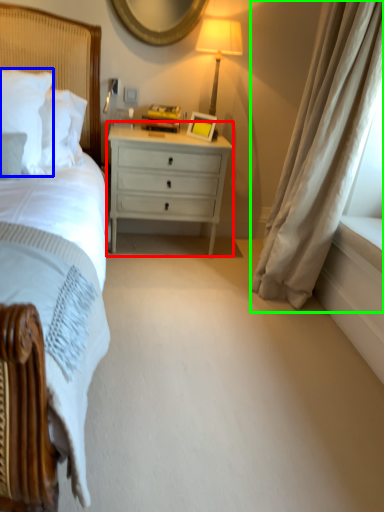
Question: Which object is positioned closest to nightstand (highlighted by a red box)? Select from pillow (highlighted by a blue box) and curtain (highlighted by a green box).

Choices:
 (A) pillow
 (B) curtain

Answer: (B)